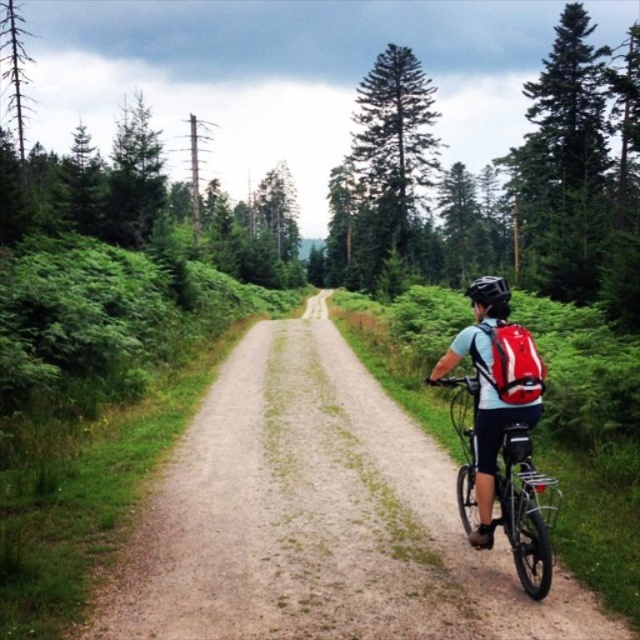
Does dirt/gravel path at center come behind red matte bicycle at right?

No, dirt/gravel path at center is in front of red matte bicycle at right.

Is dirt/gravel path at center wider than red matte bicycle at right?

Indeed, dirt/gravel path at center has a greater width compared to red matte bicycle at right.

Where is `dirt/gravel path at center`? The width and height of the screenshot is (640, 640). dirt/gravel path at center is located at coordinates (317, 518).